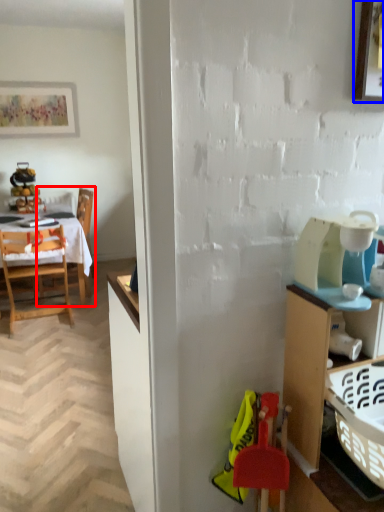
Question: Among these objects, which one is farthest to the camera, chair (highlighted by a red box) or picture frame (highlighted by a blue box)?

Choices:
 (A) chair
 (B) picture frame

Answer: (A)